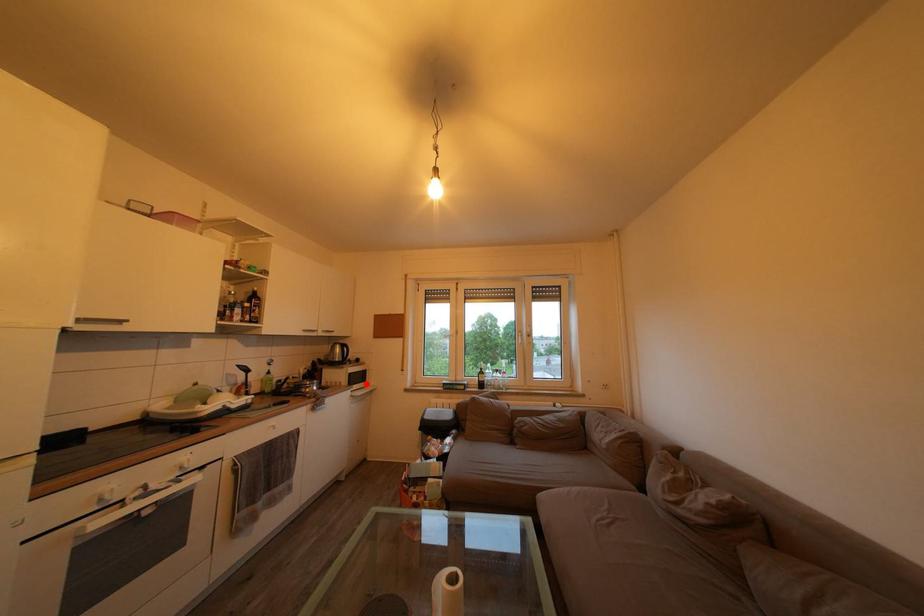
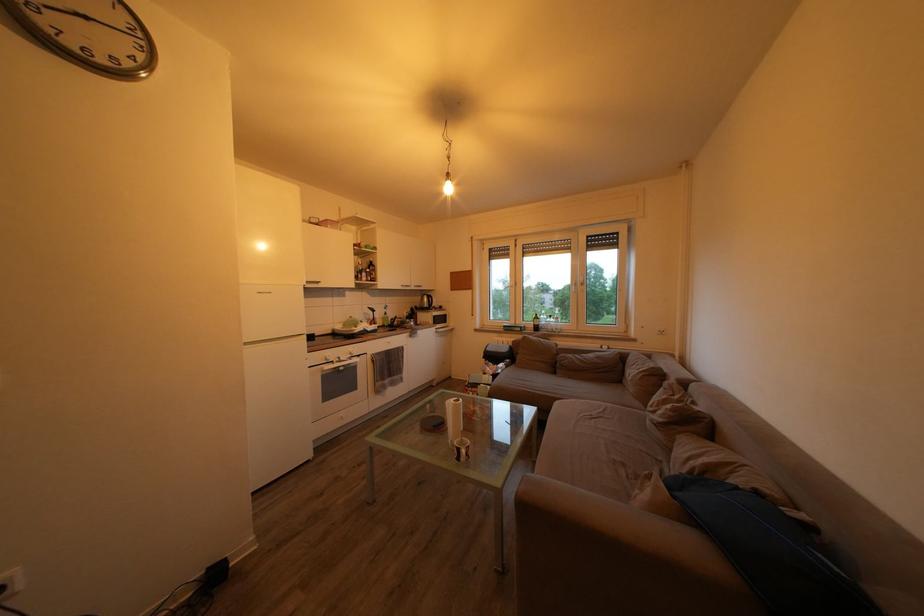
In the second image, find the point that corresponds to the highlighted location in the first image.

(448, 326)